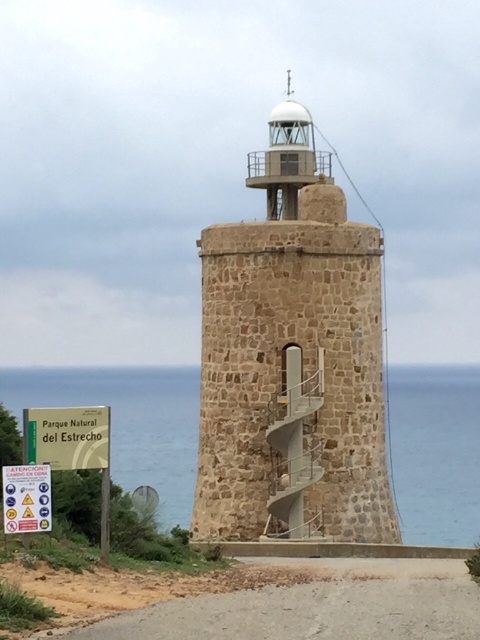
Is blue water at lower center shorter than green plastic sign at lower left?

No, blue water at lower center is not shorter than green plastic sign at lower left.

Between point (163, 516) and point (60, 468), which one is positioned in front?

Point (60, 468) is more forward.

This screenshot has width=480, height=640. I want to click on blue water at lower center, so click(x=129, y=420).

Who is more forward, (x=276, y=451) or (x=36, y=506)?

Positioned in front is point (x=36, y=506).

Is satin silver staircase at center positioned behind yellow paper sign at lower left?

Yes, it is.

Which is in front, point (292, 369) or point (22, 474)?

Point (22, 474)

Identify the location of satin silver staircase at center. The image size is (480, 640). (294, 445).

Does brown gravel road at lower center have a lesser height compared to green plastic sign at lower left?

In fact, brown gravel road at lower center may be taller than green plastic sign at lower left.

Between point (323, 561) and point (96, 465), which one is positioned in front?

Point (96, 465) is more forward.

The image size is (480, 640). What do you see at coordinates (263, 596) in the screenshot? I see `brown gravel road at lower center` at bounding box center [263, 596].

This screenshot has height=640, width=480. Find the location of `brown gravel road at lower center`. brown gravel road at lower center is located at coordinates (263, 596).